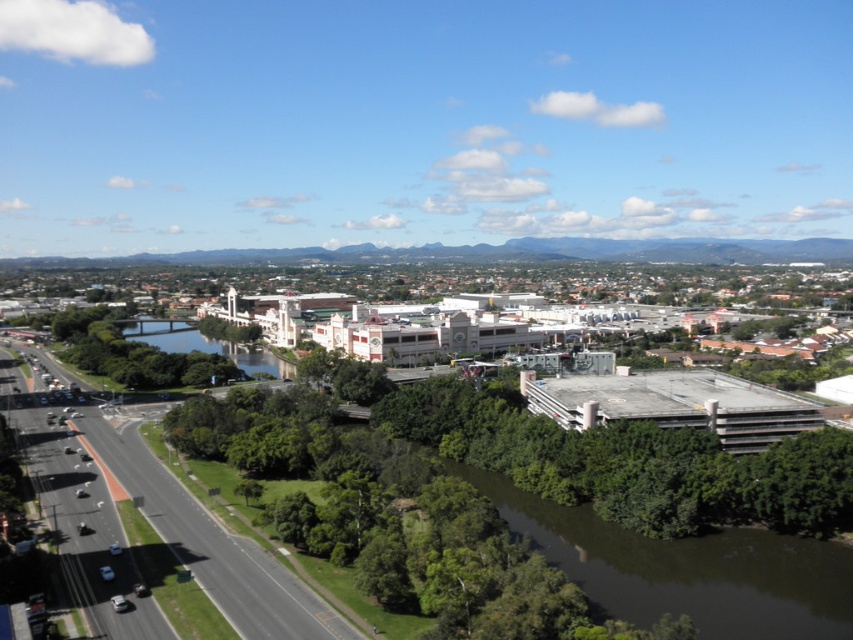
Question: Which object is positioned closest to the green murky water at lower center?

Choices:
 (A) green reflective water at center
 (B) green leafy tree at center

Answer: (A)

Question: Which point appears closest to the camera in this image?

Choices:
 (A) (218, 332)
 (B) (274, 355)

Answer: (B)

Question: Does green reflective water at center have a larger size compared to green leafy tree at center?

Choices:
 (A) no
 (B) yes

Answer: (B)

Question: Which of these objects is positioned farthest from the green murky water at lower center?

Choices:
 (A) green reflective water at center
 (B) green leafy tree at center

Answer: (B)

Question: Is green murky water at lower center closer to the viewer compared to green reflective water at center?

Choices:
 (A) yes
 (B) no

Answer: (A)

Question: Does green murky water at lower center appear under green leafy tree at center?

Choices:
 (A) no
 (B) yes

Answer: (B)